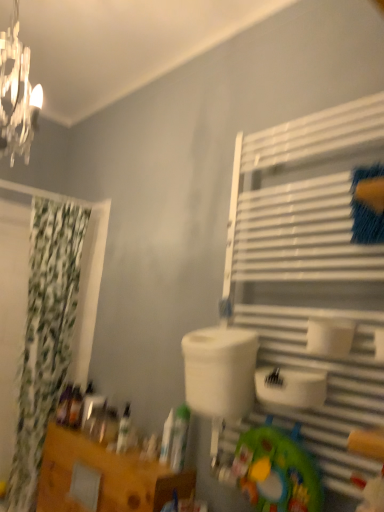
Question: Is white matte toilet paper at center-right bigger than white matte tube at center, the 1th toiletry when ordered from right to left?

Choices:
 (A) yes
 (B) no

Answer: (A)

Question: Is white matte toilet paper at center-right thinner than white matte tube at center, the 5th toiletry viewed from the left?

Choices:
 (A) no
 (B) yes

Answer: (A)

Question: Does white matte toilet paper at center-right lie in front of white matte tube at center, the 5th toiletry viewed from the left?

Choices:
 (A) no
 (B) yes

Answer: (B)

Question: Does white matte toilet paper at center-right contain white matte tube at center, marked as the 5th toiletry in a back-to-front arrangement?

Choices:
 (A) no
 (B) yes

Answer: (A)

Question: From the image's perspective, does white matte toilet paper at center-right appear lower than white matte tube at center, the first toiletry from the front?

Choices:
 (A) no
 (B) yes

Answer: (A)

Question: Is white matte tube at center, the 5th toiletry viewed from the left, at the back of white matte toilet paper at center-right?

Choices:
 (A) no
 (B) yes

Answer: (A)

Question: Does wooden table at lower left turn towards plastic green toy at lower center?

Choices:
 (A) yes
 (B) no

Answer: (B)

Question: Can you confirm if wooden table at lower left is thinner than plastic green toy at lower center?

Choices:
 (A) no
 (B) yes

Answer: (A)

Question: Can you confirm if wooden table at lower left is taller than plastic green toy at lower center?

Choices:
 (A) no
 (B) yes

Answer: (B)

Question: From the image's perspective, would you say wooden table at lower left is shown under plastic green toy at lower center?

Choices:
 (A) no
 (B) yes

Answer: (B)

Question: Considering the relative positions of wooden table at lower left and plastic green toy at lower center in the image provided, is wooden table at lower left to the right of plastic green toy at lower center from the viewer's perspective?

Choices:
 (A) yes
 (B) no

Answer: (B)

Question: Is wooden table at lower left positioned with its back to plastic green toy at lower center?

Choices:
 (A) no
 (B) yes

Answer: (A)

Question: Would you say green fabric curtain at left is outside translucent plastic bottle at lower left, which ranks as the first toiletry in back-to-front order?

Choices:
 (A) yes
 (B) no

Answer: (A)